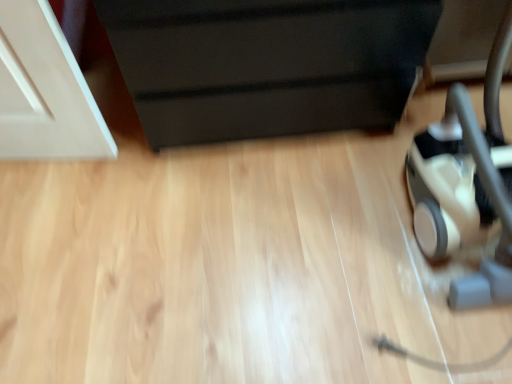
Measure the distance between point (327,38) and camera.

The distance of point (327,38) from camera is 1.04 meters.

This screenshot has height=384, width=512. What do you see at coordinates (266, 64) in the screenshot?
I see `black matte drawer at upper center` at bounding box center [266, 64].

You are a GUI agent. You are given a task and a screenshot of the screen. Output one action in this format:
    pyautogui.click(x=<x>, y=<y>)
    Task: Click on the black matte drawer at upper center
    
    Given the screenshot: What is the action you would take?
    pyautogui.click(x=266, y=64)

What is the approximate height of beige rubber baby carriage at lower right?

It is 67.96 centimeters.

What is the approximate width of beige rubber baby carriage at lower right?

beige rubber baby carriage at lower right is 51.68 centimeters wide.

The height and width of the screenshot is (384, 512). Identify the location of beige rubber baby carriage at lower right. (466, 183).

Image resolution: width=512 pixels, height=384 pixels. What do you see at coordinates (466, 183) in the screenshot?
I see `beige rubber baby carriage at lower right` at bounding box center [466, 183].

Where is `black matte drawer at upper center`? black matte drawer at upper center is located at coordinates (266, 64).

Visually, is black matte drawer at upper center positioned to the left or to the right of beige rubber baby carriage at lower right?

Based on their positions, black matte drawer at upper center is located to the left of beige rubber baby carriage at lower right.

Is black matte drawer at upper center closer to camera compared to beige rubber baby carriage at lower right?

No, it is behind beige rubber baby carriage at lower right.

Considering the points (121, 28) and (415, 137), which point is behind, point (121, 28) or point (415, 137)?

The point (415, 137) is more distant.

From the image's perspective, is black matte drawer at upper center positioned above or below beige rubber baby carriage at lower right?

black matte drawer at upper center is situated higher than beige rubber baby carriage at lower right in the image.

From a real-world perspective, is black matte drawer at upper center positioned over beige rubber baby carriage at lower right based on gravity?

No, from a real-world perspective, black matte drawer at upper center is not over beige rubber baby carriage at lower right

Considering the relative sizes of black matte drawer at upper center and beige rubber baby carriage at lower right in the image provided, is black matte drawer at upper center thinner than beige rubber baby carriage at lower right?

No.

Who is taller, black matte drawer at upper center or beige rubber baby carriage at lower right?

beige rubber baby carriage at lower right is taller.

Between black matte drawer at upper center and beige rubber baby carriage at lower right, which one has smaller size?

beige rubber baby carriage at lower right.

Is black matte drawer at upper center situated inside beige rubber baby carriage at lower right or outside?

black matte drawer at upper center is located beyond the bounds of beige rubber baby carriage at lower right.

Is black matte drawer at upper center not near beige rubber baby carriage at lower right?

black matte drawer at upper center is actually quite close to beige rubber baby carriage at lower right.

Is black matte drawer at upper center oriented away from beige rubber baby carriage at lower right?

black matte drawer at upper center does not have its back to beige rubber baby carriage at lower right.

What's the angular difference between black matte drawer at upper center and beige rubber baby carriage at lower right's facing directions?

1.21 degrees separate the facing orientations of black matte drawer at upper center and beige rubber baby carriage at lower right.

At what (x,y) coordinates should I click in order to perform the action: click on furniture on the left of beige rubber baby carriage at lower right. Please return your answer as a coordinate pair (x, y). The width and height of the screenshot is (512, 384). Looking at the image, I should click on (266, 64).

Can you confirm if beige rubber baby carriage at lower right is positioned to the left of black matte drawer at upper center?

Incorrect, beige rubber baby carriage at lower right is not on the left side of black matte drawer at upper center.

Looking at this image, considering the relative positions of beige rubber baby carriage at lower right and black matte drawer at upper center in the image provided, is beige rubber baby carriage at lower right behind black matte drawer at upper center?

No, the depth of beige rubber baby carriage at lower right is less than that of black matte drawer at upper center.

Does point (462, 210) lie behind point (125, 16)?

Yes, it is.

From the image's perspective, is beige rubber baby carriage at lower right below black matte drawer at upper center?

Yes.

From a real-world perspective, does beige rubber baby carriage at lower right stand above black matte drawer at upper center?

Correct, in the physical world, beige rubber baby carriage at lower right is higher than black matte drawer at upper center.

Between beige rubber baby carriage at lower right and black matte drawer at upper center, which one has smaller width?

With smaller width is beige rubber baby carriage at lower right.

Looking at this image, in terms of height, does beige rubber baby carriage at lower right look taller or shorter compared to black matte drawer at upper center?

Clearly, beige rubber baby carriage at lower right is taller compared to black matte drawer at upper center.

Looking at this image, can you confirm if beige rubber baby carriage at lower right is bigger than black matte drawer at upper center?

Actually, beige rubber baby carriage at lower right might be smaller than black matte drawer at upper center.

Would you say beige rubber baby carriage at lower right contains black matte drawer at upper center?

Definitely not — black matte drawer at upper center is not inside beige rubber baby carriage at lower right.

Is beige rubber baby carriage at lower right far away from black matte drawer at upper center?

They are positioned close to each other.

Is beige rubber baby carriage at lower right facing away from black matte drawer at upper center?

No, beige rubber baby carriage at lower right is not facing the opposite direction of black matte drawer at upper center.

How different are the orientations of beige rubber baby carriage at lower right and black matte drawer at upper center in degrees?

The angle between the facing direction of beige rubber baby carriage at lower right and the facing direction of black matte drawer at upper center is 1.21 degrees.

Consider the image. Measure the distance from beige rubber baby carriage at lower right to black matte drawer at upper center.

They are 16.23 inches apart.

The width and height of the screenshot is (512, 384). I want to click on baby carriage in front of the black matte drawer at upper center, so click(x=466, y=183).

Where is `baby carriage that is below the black matte drawer at upper center (from the image's perspective)`? The image size is (512, 384). baby carriage that is below the black matte drawer at upper center (from the image's perspective) is located at coordinates (466, 183).

Find the location of `furniture below the beige rubber baby carriage at lower right (from a real-world perspective)`. furniture below the beige rubber baby carriage at lower right (from a real-world perspective) is located at coordinates (266, 64).